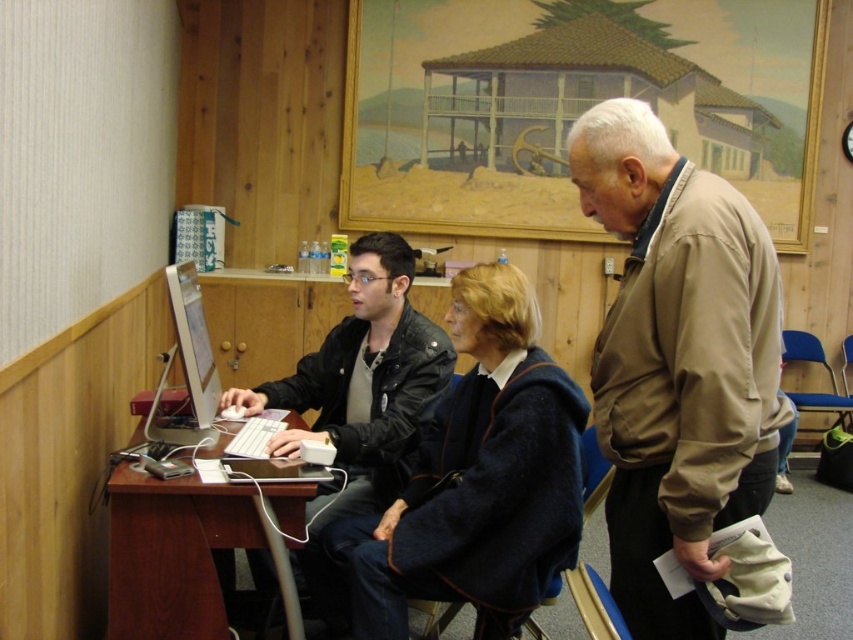
What do you see at coordinates (477, 480) in the screenshot? I see `navy blue sweater at center` at bounding box center [477, 480].

Who is positioned more to the right, navy blue sweater at center or black leather jacket at center?

navy blue sweater at center is more to the right.

Image resolution: width=853 pixels, height=640 pixels. I want to click on navy blue sweater at center, so click(477, 480).

Find the location of a particular element. The height and width of the screenshot is (640, 853). navy blue sweater at center is located at coordinates (477, 480).

Looking at this image, can you confirm if brown wooden table at lower left is positioned to the right of matte plastic monitor at center left?

Indeed, brown wooden table at lower left is positioned on the right side of matte plastic monitor at center left.

The height and width of the screenshot is (640, 853). In order to click on brown wooden table at lower left in this screenshot , I will do `click(190, 550)`.

Who is positioned more to the right, black leather jacket at center or matte plastic monitor at center left?

From the viewer's perspective, black leather jacket at center appears more on the right side.

Who is higher up, black leather jacket at center or matte plastic monitor at center left?

Positioned higher is matte plastic monitor at center left.

Measure the distance between black leather jacket at center and camera.

2.03 meters

Image resolution: width=853 pixels, height=640 pixels. Identify the location of black leather jacket at center. (363, 385).